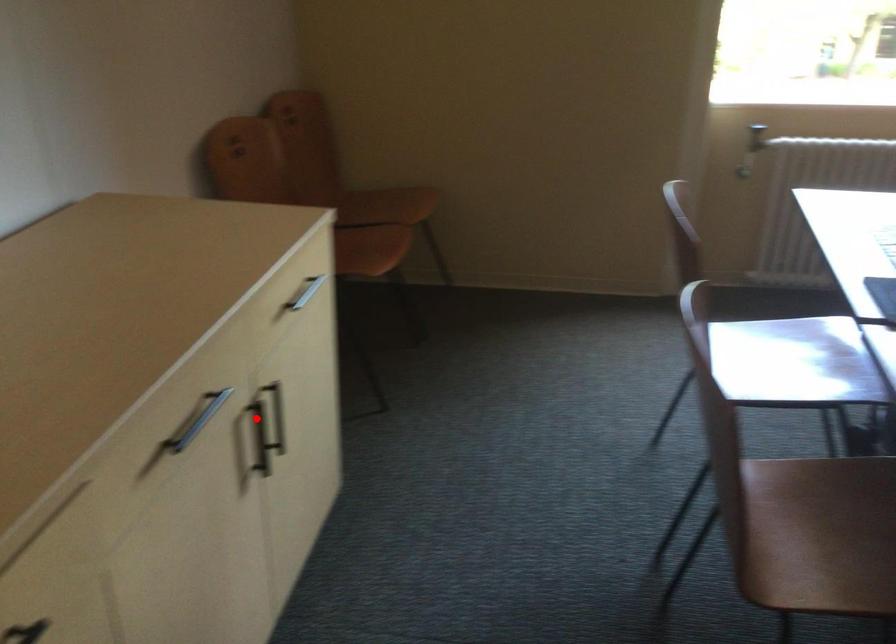
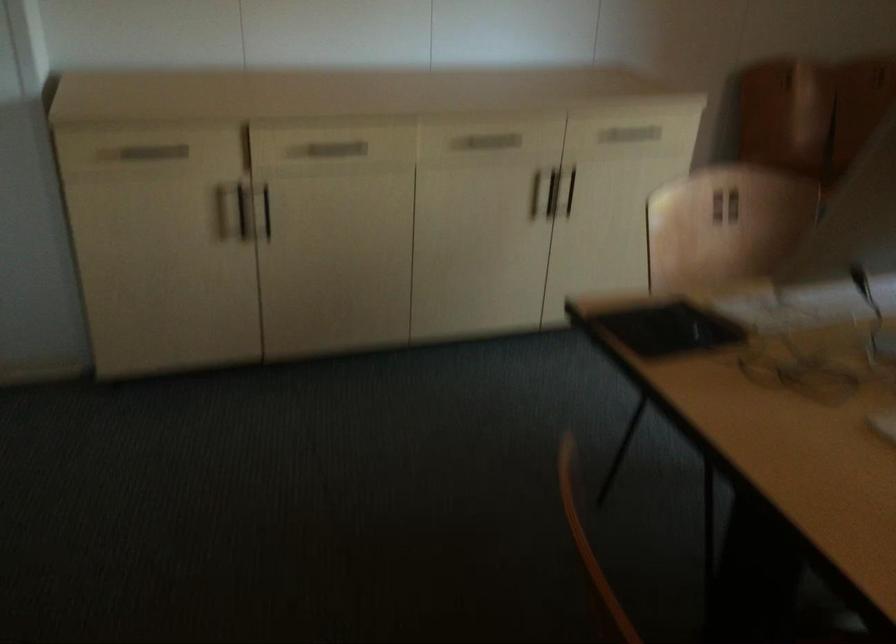
Find the pixel in the second image that matches the highlighted location in the first image.

(570, 192)